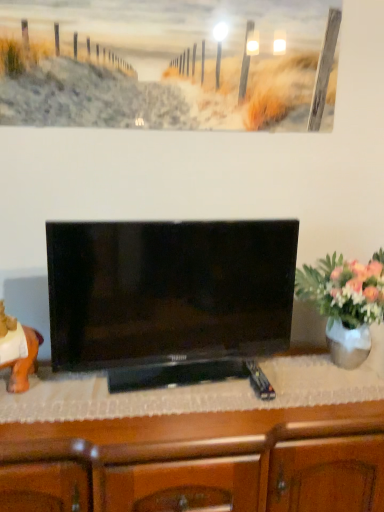
Locate an element on the screen. The width and height of the screenshot is (384, 512). vacant region above wooden cabinet at center (from a real-world perspective) is located at coordinates (170, 391).